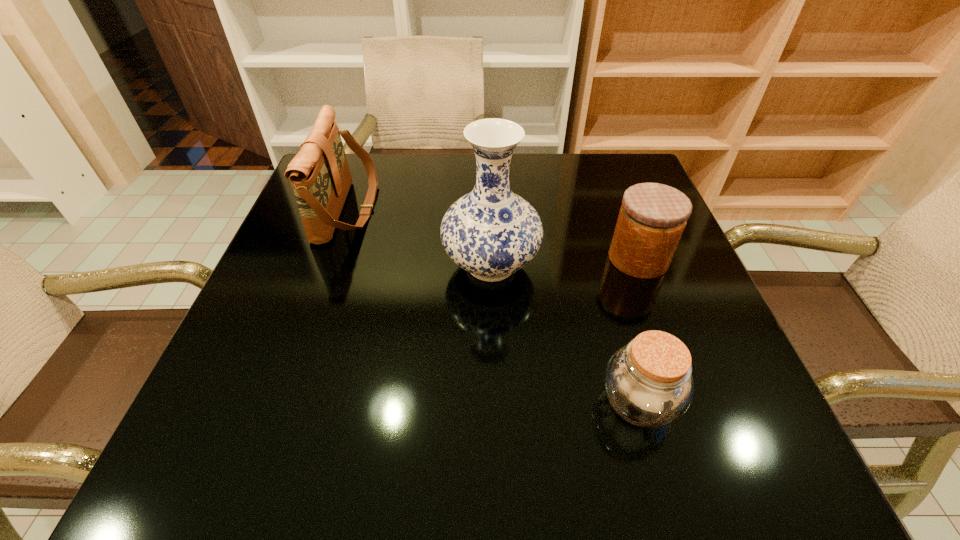
Locate which object is the third closest to the third shortest object. Please provide its 2D coordinates. Your answer should be formatted as a tuple, i.e. [(x, y)], where the tuple contains the x and y coordinates of a point satisfying the conditions above.

[(648, 382)]

Locate an element on the screen. The width and height of the screenshot is (960, 540). blank space that satisfies the following two spatial constraints: 1. on the front-facing side of the farther jar; 2. on the left side of the second tallest object is located at coordinates (330, 259).

You are a GUI agent. You are given a task and a screenshot of the screen. Output one action in this format:
    pyautogui.click(x=<x>, y=<y>)
    Task: Click on the vacant area that satisfies the following two spatial constraints: 1. on the front-facing side of the tallest object; 2. on the left side of the shoulder bag
    The width and height of the screenshot is (960, 540).
    Given the screenshot: What is the action you would take?
    pyautogui.click(x=328, y=265)

Where is `free space that satisfies the following two spatial constraints: 1. on the back side of the farther jar; 2. on the left side of the vase`? free space that satisfies the following two spatial constraints: 1. on the back side of the farther jar; 2. on the left side of the vase is located at coordinates (491, 259).

Find the location of a particular element. Image resolution: width=960 pixels, height=540 pixels. free spot that satisfies the following two spatial constraints: 1. on the back side of the nearer jar; 2. on the right side of the farther jar is located at coordinates tap(598, 259).

Locate an element on the screen. free space in the image that satisfies the following two spatial constraints: 1. on the front-facing side of the leftmost object; 2. on the right side of the second object from left to right is located at coordinates (328, 265).

The height and width of the screenshot is (540, 960). Identify the location of vacant area that satisfies the following two spatial constraints: 1. on the front-facing side of the nearest object; 2. on the left side of the second tallest object. (279, 403).

Identify the location of vacant space that satisfies the following two spatial constraints: 1. on the front-facing side of the shoulder bag; 2. on the back side of the second object from left to right. (328, 265).

Where is `free location that satisfies the following two spatial constraints: 1. on the back side of the farther jar; 2. on the right side of the nearest object`? free location that satisfies the following two spatial constraints: 1. on the back side of the farther jar; 2. on the right side of the nearest object is located at coordinates (598, 259).

Identify the location of vacant space that satisfies the following two spatial constraints: 1. on the front-facing side of the third shortest object; 2. on the left side of the third object from right to left. (328, 265).